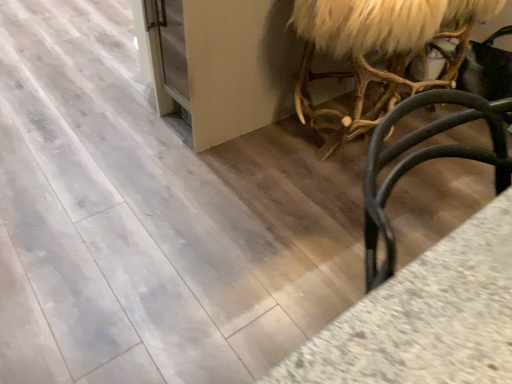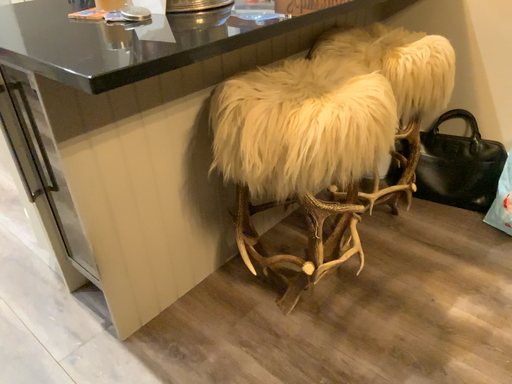
Question: How did the camera likely rotate when shooting the video?

Choices:
 (A) rotated upward
 (B) rotated downward

Answer: (A)